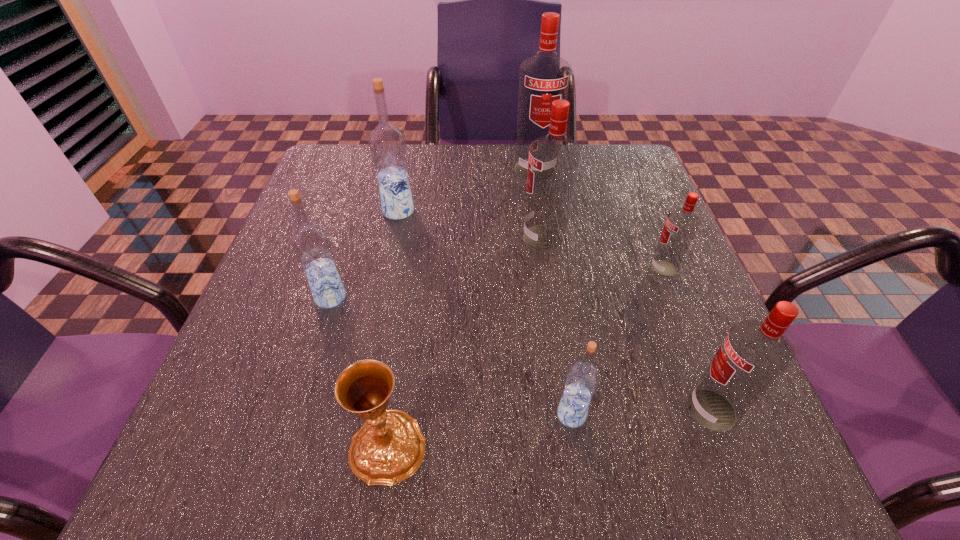
Identify the location of the third closest vodka to the third nearest vodka. (582, 378).

Identify which vodka is the second closest to the fourth nearest vodka. Please provide its 2D coordinates. Your answer should be formatted as a tuple, i.e. [(x, y)], where the tuple contains the x and y coordinates of a point satisfying the conditions above.

[(754, 354)]

This screenshot has height=540, width=960. Find the location of `red vodka object that ranks as the second closest to the third biggest red vodka`. red vodka object that ranks as the second closest to the third biggest red vodka is located at coordinates (553, 161).

This screenshot has width=960, height=540. In order to click on red vodka object that ranks as the third closest to the fifth nearest vodka in this screenshot , I will do `click(754, 354)`.

Locate an element on the screen. This screenshot has height=540, width=960. blue vodka that is the third closest to the tallest object is located at coordinates (582, 378).

Point out which blue vodka is positioned as the third nearest to the third farthest red vodka. Please provide its 2D coordinates. Your answer should be formatted as a tuple, i.e. [(x, y)], where the tuple contains the x and y coordinates of a point satisfying the conditions above.

[(311, 244)]

Identify the location of vacant space that satisfies the following two spatial constraints: 1. on the front label of the farthest vodka; 2. on the front label of the third nearest red vodka. (546, 238).

At what (x,y) coordinates should I click in order to perform the action: click on vacant point that satisfies the following two spatial constraints: 1. on the front label of the third nearest red vodka; 2. on the front side of the second nearest blue vodka. Please return your answer as a coordinate pair (x, y). Image resolution: width=960 pixels, height=540 pixels. Looking at the image, I should click on (552, 298).